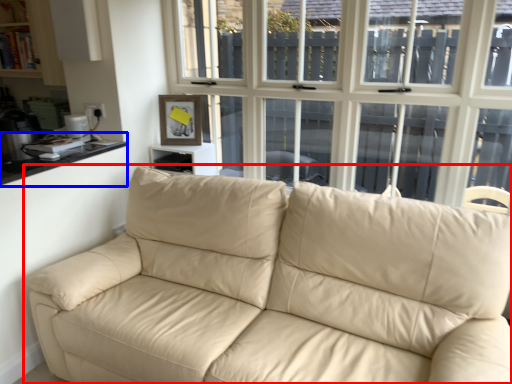
Question: Which object appears farthest to the camera in this image, studio couch (highlighted by a red box) or counter top (highlighted by a blue box)?

Choices:
 (A) studio couch
 (B) counter top

Answer: (B)